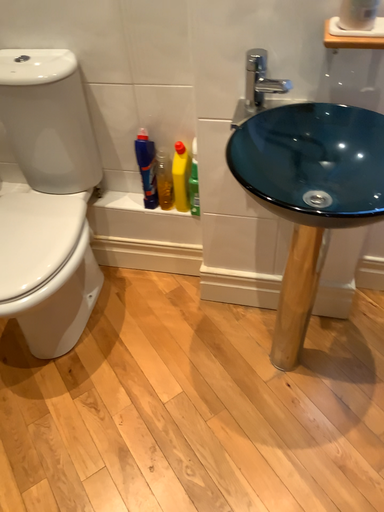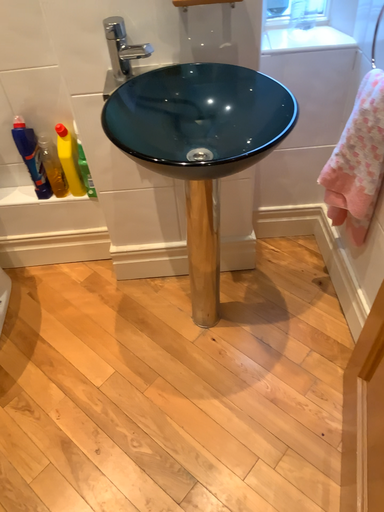
Question: Which way did the camera rotate in the video?

Choices:
 (A) rotated left
 (B) rotated right

Answer: (B)